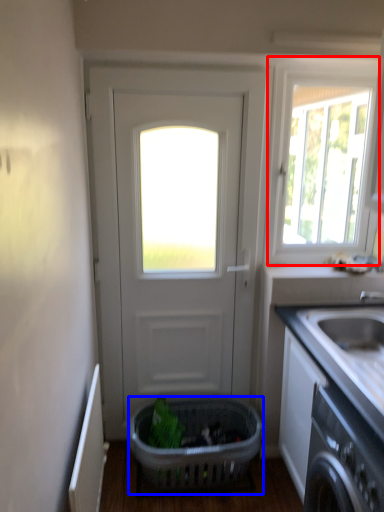
Question: Which of the following is the farthest to the observer, window (highlighted by a red box) or basket (highlighted by a blue box)?

Choices:
 (A) window
 (B) basket

Answer: (A)